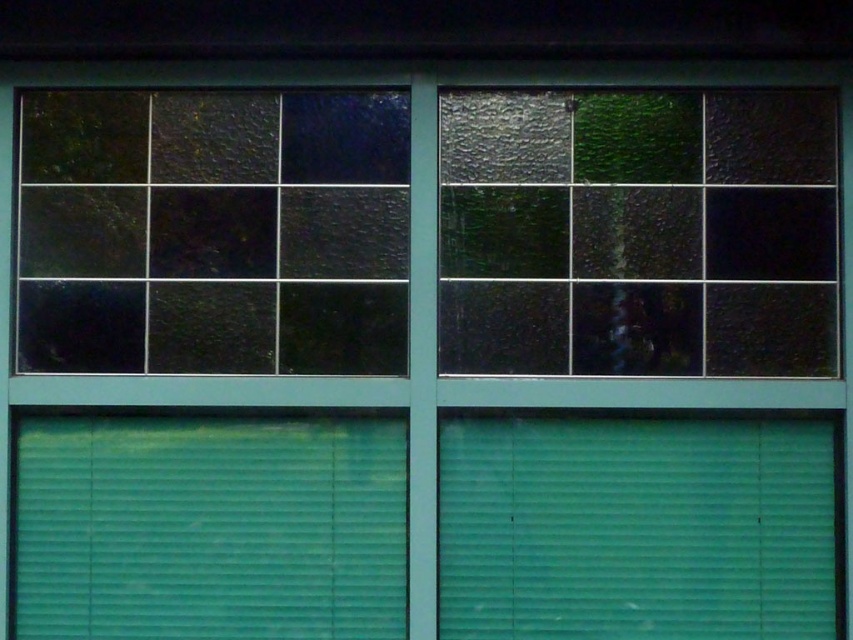
You are an architect designing a new building. You need to ensure that the textured glass window at upper left and the green matte shutter at lower left meet specific height requirements. According to the design specifications, the window must be taller than the shutter. Does the current design comply with this requirement?

Yes, the current design complies with the requirement because the textured glass window at upper left is taller than the green matte shutter at lower left as specified.